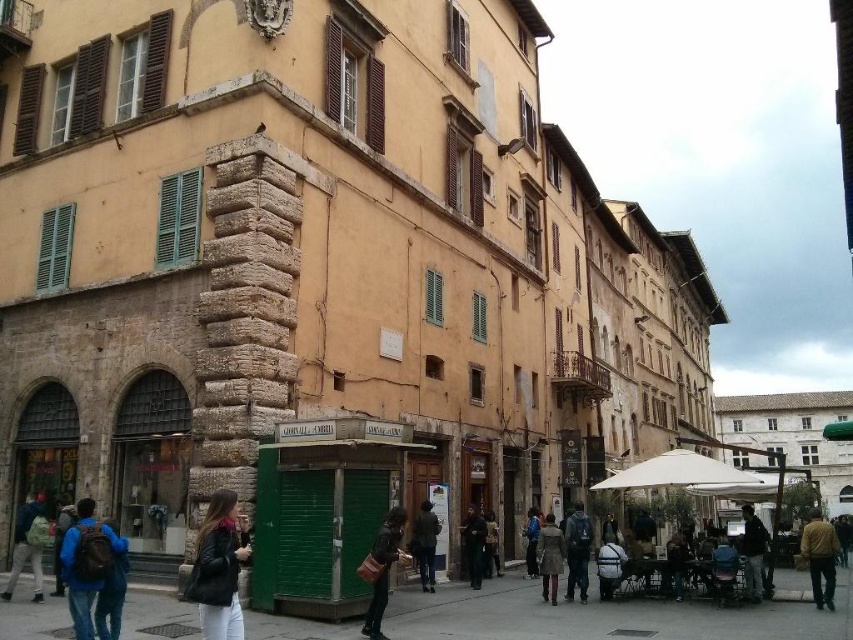
Question: Which point is closer to the camera?

Choices:
 (A) dark brown leather coat at center
 (B) dark blue backpack at lower left

Answer: (B)

Question: Does leather brown bag at center appear under brown leather jacket at lower right?

Choices:
 (A) no
 (B) yes

Answer: (A)

Question: Estimate the real-world distances between objects in this image. Which object is farther from the leather jacket at lower left?

Choices:
 (A) dark green coat at center
 (B) white fabric backpack at lower center

Answer: (B)

Question: Is leather jacket at center thinner than blue denim jacket at lower center?

Choices:
 (A) yes
 (B) no

Answer: (B)

Question: In this image, where is leather brown bag at center located relative to dark brown leather coat at center?

Choices:
 (A) left
 (B) right

Answer: (A)

Question: Estimate the real-world distances between objects in this image. Which object is farther from the dark green coat at center?

Choices:
 (A) brown leather coat at center
 (B) leather jacket at lower left
 (C) dark blue jacket at lower right
 (D) leather brown bag at center

Answer: (C)